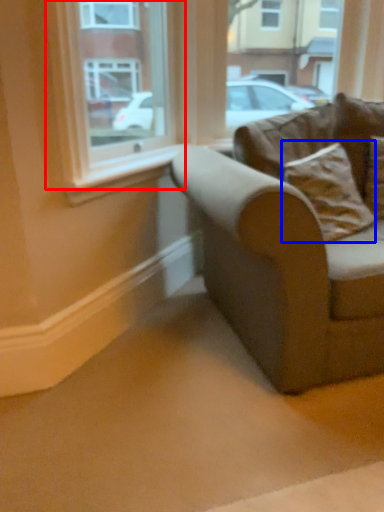
Question: Which of the following is the closest to the observer, window (highlighted by a red box) or pillow (highlighted by a blue box)?

Choices:
 (A) window
 (B) pillow

Answer: (A)